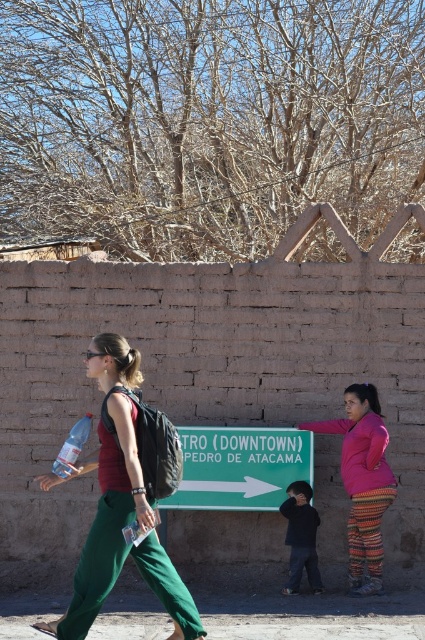
You are standing in front of the adobe wall in the image and want to find the green plastic sign at center. Where should you look relative to the wall?

The green plastic sign at center is located at point (x=240, y=467) relative to the wall, so you should look towards the center area slightly to the right and above the wall to find it.

You are standing at the point with coordinates point (110, 490) and want to walk to the point with coordinates point (291, 540). Based on the scene description, which direction should you face to move towards your destination?

To move from point (110, 490) to point (291, 540), you should face towards the right, as the destination point is to the right and slightly behind the starting point according to their coordinates.

You are a tour guide carrying a backpack that is 2 meters wide. You need to walk between the matte red shirt at center and the dark blue sweater at center. Can your backpack fit through the space between them?

The distance between the matte red shirt at center and the dark blue sweater at center is 1.99 meters. Since the backpack is 2 meters wide, it is slightly too wide to fit through the space between them.